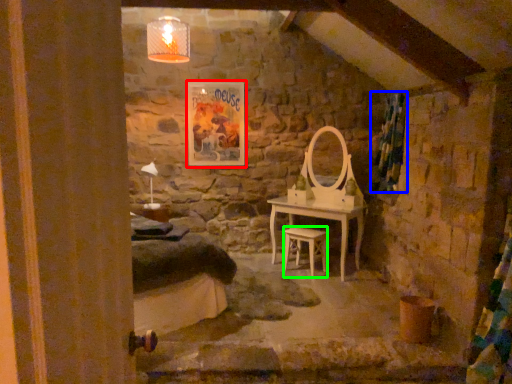
Question: Which object is the closest to the picture frame (highlighted by a red box)? Choose among these: curtain (highlighted by a blue box) or stool (highlighted by a green box).

Choices:
 (A) curtain
 (B) stool

Answer: (B)